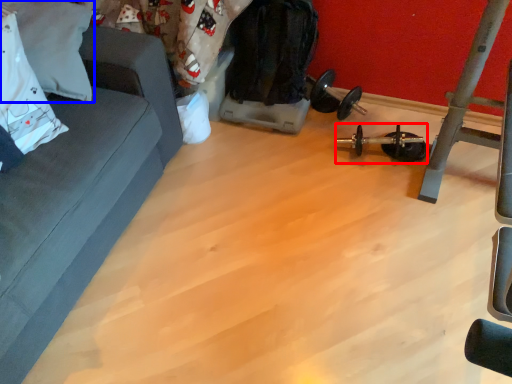
Question: Which point is further to the camera, equipment (highlighted by a red box) or pillow (highlighted by a blue box)?

Choices:
 (A) equipment
 (B) pillow

Answer: (A)